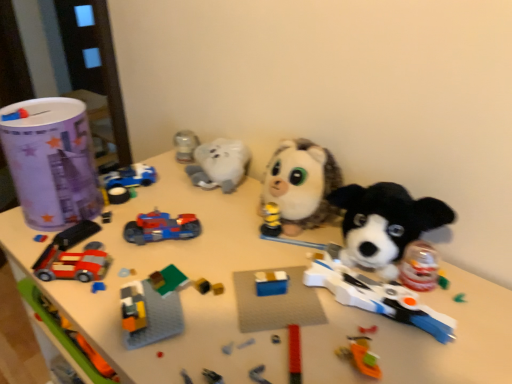
Locate an element on the screen. white matte table at center is located at coordinates (186, 288).

The width and height of the screenshot is (512, 384). What do you see at coordinates (126, 182) in the screenshot? I see `blue plastic car at upper left, positioned as the third toy in right-to-left order` at bounding box center [126, 182].

The width and height of the screenshot is (512, 384). I want to click on paper cup at left, marked as the fifth toy in a right-to-left arrangement, so click(51, 161).

The image size is (512, 384). What do you see at coordinates (161, 228) in the screenshot? I see `shiny plastic toy car at center, the fourth toy positioned from the left` at bounding box center [161, 228].

You are a GUI agent. You are given a task and a screenshot of the screen. Output one action in this format:
    pyautogui.click(x=<x>, y=<y>)
    Task: Click on the white matte table at center
    
    Given the screenshot: What is the action you would take?
    pyautogui.click(x=186, y=288)

Considering the positions of objects brick-like plastic car at lower left, arranged as the 4th toy when viewed from the right, and white matte table at center in the image provided, who is more to the left, brick-like plastic car at lower left, arranged as the 4th toy when viewed from the right, or white matte table at center?

From the viewer's perspective, brick-like plastic car at lower left, arranged as the 4th toy when viewed from the right, appears more on the left side.

From a real-world perspective, between brick-like plastic car at lower left, the 2th toy in the left-to-right sequence, and white matte table at center, who is vertically higher?

brick-like plastic car at lower left, the 2th toy in the left-to-right sequence, from a real-world perspective.

Considering the sizes of brick-like plastic car at lower left, the 2th toy in the left-to-right sequence, and white matte table at center in the image, is brick-like plastic car at lower left, the 2th toy in the left-to-right sequence, bigger or smaller than white matte table at center?

brick-like plastic car at lower left, the 2th toy in the left-to-right sequence, is smaller than white matte table at center.

Looking at this image, can you confirm if brick-like plastic car at lower left, arranged as the 4th toy when viewed from the right, is wider than white matte table at center?

Incorrect, the width of brick-like plastic car at lower left, arranged as the 4th toy when viewed from the right, does not surpass that of white matte table at center.

From a real-world perspective, who is located lower, shiny plastic toy car at center, the fourth toy positioned from the left, or blue plastic car at upper left, positioned as the third toy in right-to-left order?

blue plastic car at upper left, positioned as the third toy in right-to-left order.

How far apart are shiny plastic toy car at center, which is counted as the second toy, starting from the right, and blue plastic car at upper left, positioned as the 3th toy in left-to-right order?

7.51 inches.

Does shiny plastic toy car at center, the fourth toy positioned from the left, have a smaller size compared to blue plastic car at upper left, positioned as the 3th toy in left-to-right order?

No, shiny plastic toy car at center, the fourth toy positioned from the left, is not smaller than blue plastic car at upper left, positioned as the 3th toy in left-to-right order.

How many degrees apart are the facing directions of shiny plastic toy car at center, the fourth toy positioned from the left, and blue plastic car at upper left, positioned as the third toy in right-to-left order?

They differ by 15.5 degrees in their facing directions.

From the image's perspective, which toy is the 3rd one above the white matte table at center? Please provide its 2D coordinates.

[(301, 185)]

From a real-world perspective, is white matte table at center positioned under fluffy white plush at center, acting as the 1th toy starting from the right, based on gravity?

Yes, from a real-world perspective, white matte table at center is below fluffy white plush at center, acting as the 1th toy starting from the right.

Would you say fluffy white plush at center, acting as the 1th toy starting from the right, is part of white matte table at center's contents?

No, white matte table at center does not contain fluffy white plush at center, acting as the 1th toy starting from the right.

Is blue plastic car at upper left, positioned as the 3th toy in left-to-right order, taller than paper cup at left, the 1th toy viewed from the left?

No, blue plastic car at upper left, positioned as the 3th toy in left-to-right order, is not taller than paper cup at left, the 1th toy viewed from the left.

Looking at this image, which is behind, blue plastic car at upper left, positioned as the 3th toy in left-to-right order, or paper cup at left, the 1th toy viewed from the left?

blue plastic car at upper left, positioned as the 3th toy in left-to-right order, is further from the camera.

Is blue plastic car at upper left, positioned as the third toy in right-to-left order, facing away from paper cup at left, the 1th toy viewed from the left?

blue plastic car at upper left, positioned as the third toy in right-to-left order, is not turned away from paper cup at left, the 1th toy viewed from the left.

From the image's perspective, between blue plastic car at upper left, positioned as the third toy in right-to-left order, and paper cup at left, the 1th toy viewed from the left, which one is located above?

paper cup at left, the 1th toy viewed from the left.

Is fluffy white plush at center, placed as the 5th toy when sorted from left to right, at the left side of paper cup at left, the 1th toy viewed from the left?

Incorrect, fluffy white plush at center, placed as the 5th toy when sorted from left to right, is not on the left side of paper cup at left, the 1th toy viewed from the left.

Is fluffy white plush at center, placed as the 5th toy when sorted from left to right, directly adjacent to paper cup at left, marked as the fifth toy in a right-to-left arrangement?

No, fluffy white plush at center, placed as the 5th toy when sorted from left to right, is not beside paper cup at left, marked as the fifth toy in a right-to-left arrangement.

Can you confirm if fluffy white plush at center, placed as the 5th toy when sorted from left to right, is thinner than paper cup at left, marked as the fifth toy in a right-to-left arrangement?

No.

From the image's perspective, would you say fluffy white plush at center, acting as the 1th toy starting from the right, is positioned over paper cup at left, the 1th toy viewed from the left?

No, from the image's perspective, fluffy white plush at center, acting as the 1th toy starting from the right, is not on top of paper cup at left, the 1th toy viewed from the left.

Would you say paper cup at left, marked as the fifth toy in a right-to-left arrangement, is to the left or to the right of white matte table at center in the picture?

paper cup at left, marked as the fifth toy in a right-to-left arrangement, is positioned on white matte table at center's left side.

Is paper cup at left, the 1th toy viewed from the left, wider than white matte table at center?

No.

This screenshot has height=384, width=512. What are the coordinates of `table in front of the paper cup at left, marked as the fifth toy in a right-to-left arrangement` in the screenshot? It's located at (186, 288).

Does paper cup at left, the 1th toy viewed from the left, have a lesser height compared to white matte table at center?

Indeed, paper cup at left, the 1th toy viewed from the left, has a lesser height compared to white matte table at center.

Which is more to the left, blue plastic car at upper left, positioned as the 3th toy in left-to-right order, or shiny plastic toy car at center, which is counted as the second toy, starting from the right?

Positioned to the left is blue plastic car at upper left, positioned as the 3th toy in left-to-right order.

Considering the relative sizes of blue plastic car at upper left, positioned as the 3th toy in left-to-right order, and shiny plastic toy car at center, the fourth toy positioned from the left, in the image provided, is blue plastic car at upper left, positioned as the 3th toy in left-to-right order, wider than shiny plastic toy car at center, the fourth toy positioned from the left,?

In fact, blue plastic car at upper left, positioned as the 3th toy in left-to-right order, might be narrower than shiny plastic toy car at center, the fourth toy positioned from the left.

Would you say blue plastic car at upper left, positioned as the 3th toy in left-to-right order, contains shiny plastic toy car at center, the fourth toy positioned from the left?

No, blue plastic car at upper left, positioned as the 3th toy in left-to-right order, does not contain shiny plastic toy car at center, the fourth toy positioned from the left.

Find the location of a particular element. Image resolution: width=512 pixels, height=384 pixels. table in front of the brick-like plastic car at lower left, the 2th toy in the left-to-right sequence is located at coordinates (186, 288).

From the image's perspective, which toy is the 2nd one below the blue plastic car at upper left, positioned as the third toy in right-to-left order? Please provide its 2D coordinates.

[(161, 228)]

From the picture: When comparing their distances from brick-like plastic car at lower left, the 2th toy in the left-to-right sequence, does blue plastic car at upper left, positioned as the third toy in right-to-left order, or fluffy white plush at center, acting as the 1th toy starting from the right, seem further?

Based on the image, fluffy white plush at center, acting as the 1th toy starting from the right, appears to be further to brick-like plastic car at lower left, the 2th toy in the left-to-right sequence.

From the image, which object appears to be farther from blue plastic car at upper left, positioned as the third toy in right-to-left order, white matte table at center or fluffy white plush at center, placed as the 5th toy when sorted from left to right?

fluffy white plush at center, placed as the 5th toy when sorted from left to right.

When comparing their distances from white matte table at center, does fluffy white plush at center, acting as the 1th toy starting from the right, or blue plastic car at upper left, positioned as the 3th toy in left-to-right order, seem further?

Based on the image, blue plastic car at upper left, positioned as the 3th toy in left-to-right order, appears to be further to white matte table at center.

Looking at the image, which one is located further to shiny plastic toy car at center, which is counted as the second toy, starting from the right, blue plastic car at upper left, positioned as the third toy in right-to-left order, or brick-like plastic car at lower left, the 2th toy in the left-to-right sequence?

blue plastic car at upper left, positioned as the third toy in right-to-left order.

From the picture: When comparing their distances from paper cup at left, marked as the fifth toy in a right-to-left arrangement, does white matte table at center or shiny plastic toy car at center, which is counted as the second toy, starting from the right, seem further?

white matte table at center is further to paper cup at left, marked as the fifth toy in a right-to-left arrangement.

Considering their positions, is shiny plastic toy car at center, the fourth toy positioned from the left, positioned closer to fluffy white plush at center, acting as the 1th toy starting from the right, than brick-like plastic car at lower left, arranged as the 4th toy when viewed from the right?

shiny plastic toy car at center, the fourth toy positioned from the left, is positioned closer to the anchor fluffy white plush at center, acting as the 1th toy starting from the right.

In the scene shown: Based on their spatial positions, is blue plastic car at upper left, positioned as the 3th toy in left-to-right order, or white matte table at center further from brick-like plastic car at lower left, the 2th toy in the left-to-right sequence?

white matte table at center lies further to brick-like plastic car at lower left, the 2th toy in the left-to-right sequence, than the other object.

When comparing their distances from shiny plastic toy car at center, the fourth toy positioned from the left, does paper cup at left, marked as the fifth toy in a right-to-left arrangement, or fluffy white plush at center, acting as the 1th toy starting from the right, seem closer?

Based on the image, paper cup at left, marked as the fifth toy in a right-to-left arrangement, appears to be nearer to shiny plastic toy car at center, the fourth toy positioned from the left.

At what (x,y) coordinates should I click in order to perform the action: click on toy between paper cup at left, marked as the fifth toy in a right-to-left arrangement, and blue plastic car at upper left, positioned as the third toy in right-to-left order, from front to back. Please return your answer as a coordinate pair (x, y). This screenshot has width=512, height=384. Looking at the image, I should click on (161, 228).

I want to click on toy between blue plastic car at upper left, positioned as the third toy in right-to-left order, and fluffy white plush at center, placed as the 5th toy when sorted from left to right, so click(x=161, y=228).